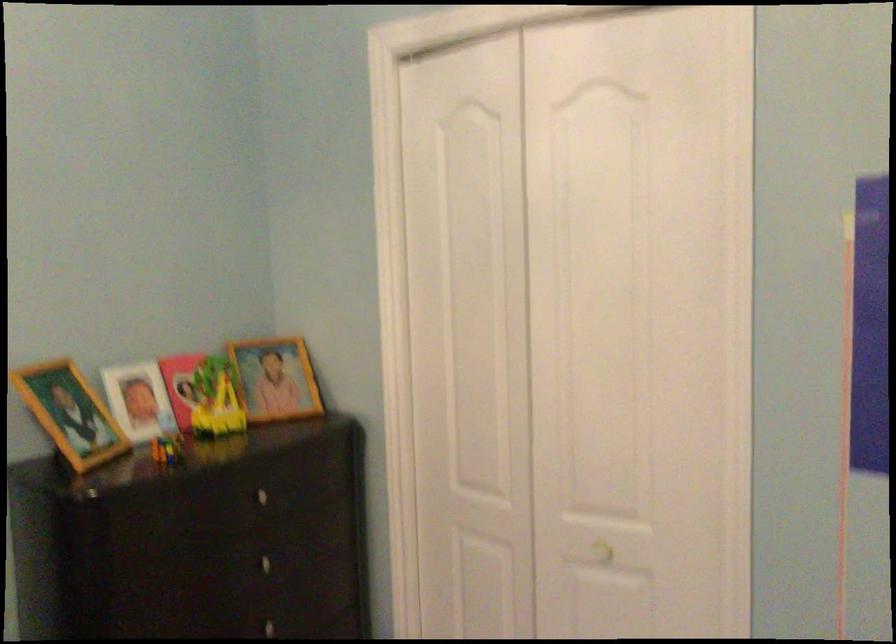
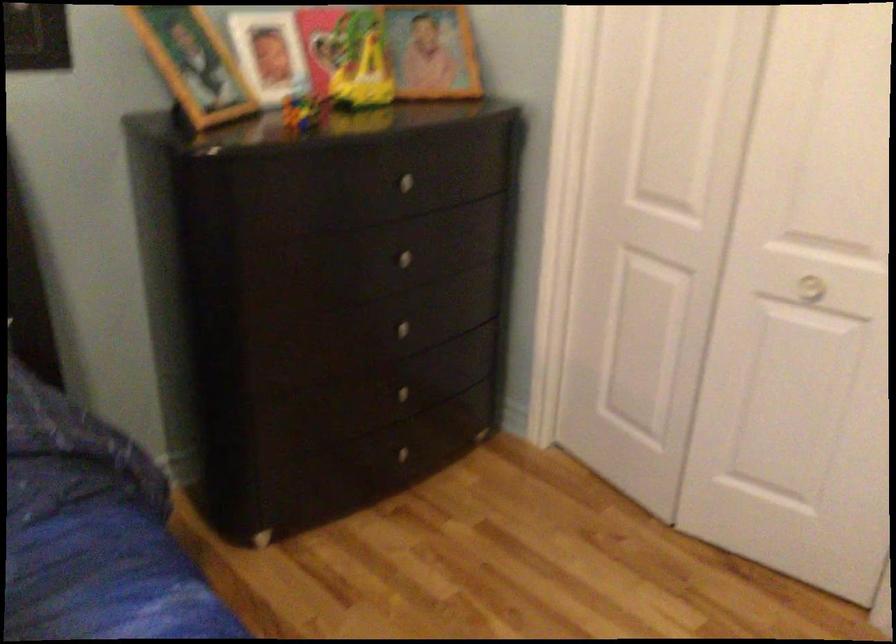
Find the pixel in the second image that matches point 263,491 in the first image.

(408, 178)